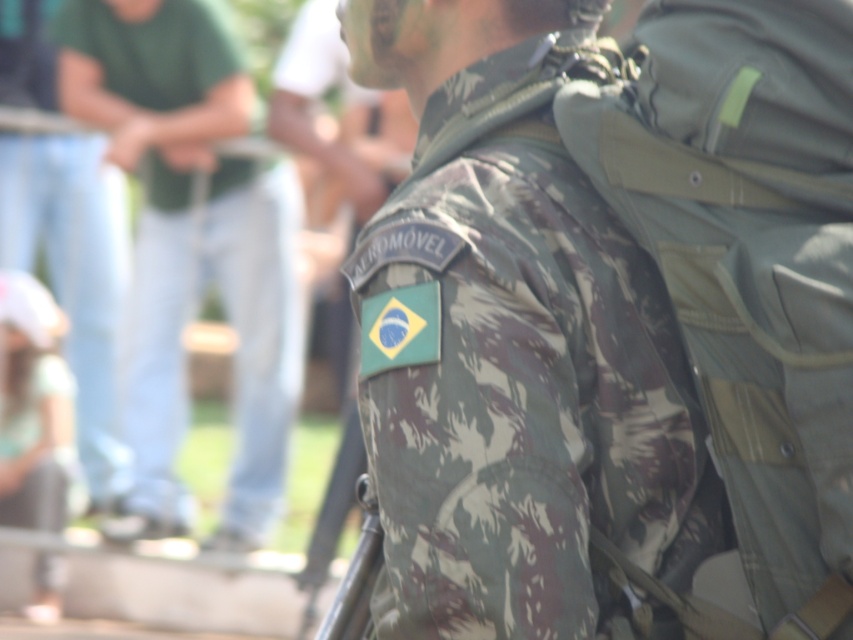
Is camouflage fabric uniform at center positioned at the back of camouflage fabric uniform at left?

No, camouflage fabric uniform at center is in front of camouflage fabric uniform at left.

Which of these two, camouflage fabric uniform at center or camouflage fabric uniform at left, stands taller?

Standing taller between the two is camouflage fabric uniform at left.

Where is `camouflage fabric uniform at center`? camouflage fabric uniform at center is located at coordinates (515, 356).

Where is `camouflage fabric uniform at center`? The width and height of the screenshot is (853, 640). camouflage fabric uniform at center is located at coordinates (515, 356).